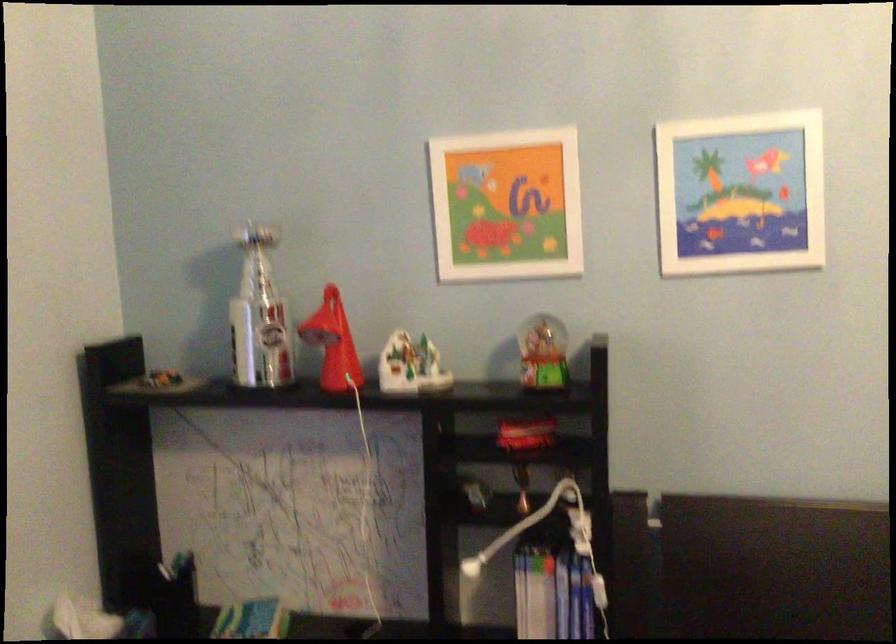
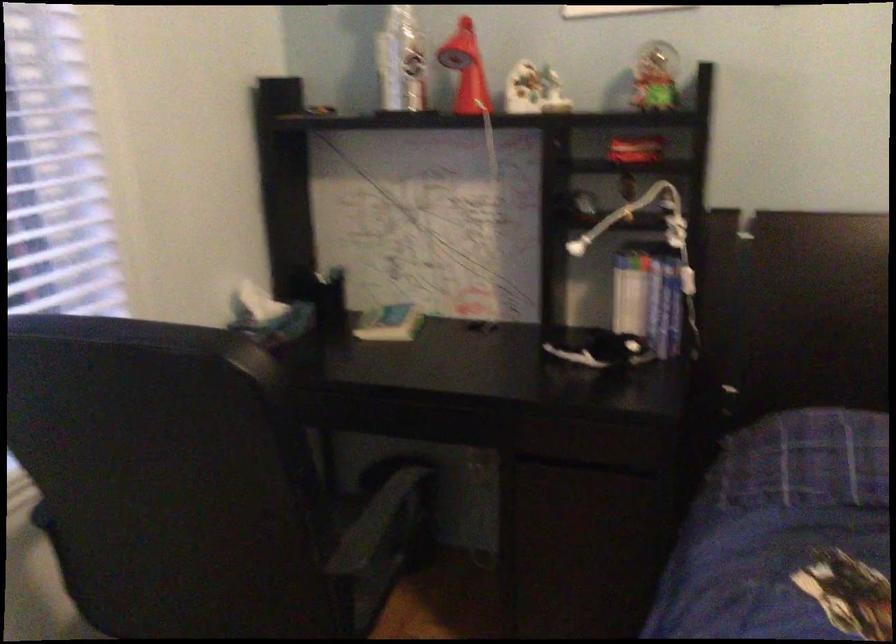
Question: Which direction would the cameraman need to move to produce the second image? Reply with the corresponding letter.

Choices:
 (A) Left
 (B) Right
 (C) Forward
 (D) Backward

Answer: (D)